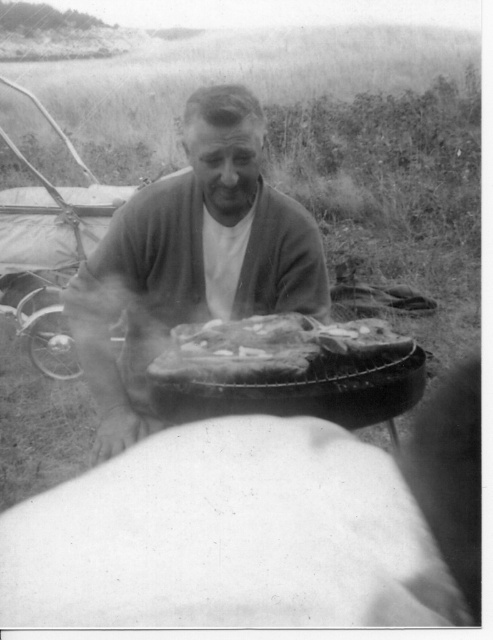
You are a photographer analyzing the composition of this image. You notice the smooth leather jacket at center and the charred wooden platter at center. Which object is positioned more to the left side of the image?

The smooth leather jacket at center is positioned more to the left side of the image compared to the charred wooden platter at center.

You are standing in the scene and want to pick up the smooth leather jacket at center and the charred wooden platter at center. Which object should you reach for first to grab the one closer to you?

The smooth leather jacket at center is closer to you, so you should reach for it first.